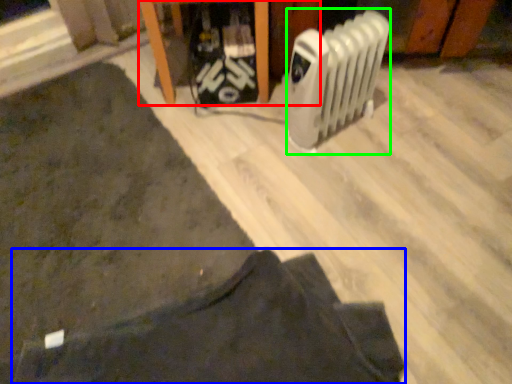
Question: Based on their relative distances, which object is farther from furniture (highlighted by a red box)? Choose from clothing (highlighted by a blue box) and radiator (highlighted by a green box).

Choices:
 (A) clothing
 (B) radiator

Answer: (A)